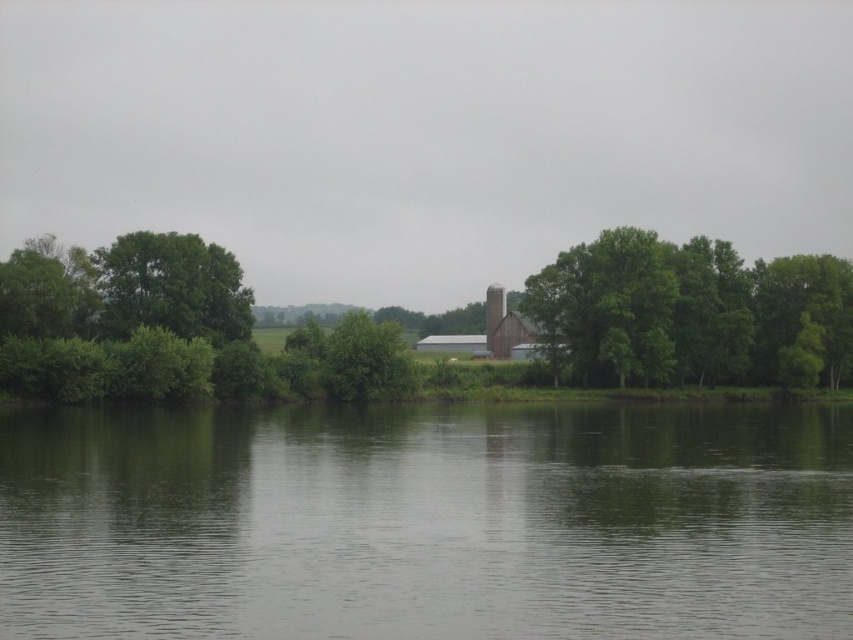
Is green leafy tree at center below brown wooden chimney at center?

Yes, green leafy tree at center is below brown wooden chimney at center.

What do you see at coordinates (691, 314) in the screenshot? The width and height of the screenshot is (853, 640). I see `green leafy tree at center` at bounding box center [691, 314].

This screenshot has width=853, height=640. What are the coordinates of `green leafy tree at center` in the screenshot? It's located at (691, 314).

Can you confirm if green smooth water at lower center is smaller than green leafy tree at center?

Correct, green smooth water at lower center occupies less space than green leafy tree at center.

Which is in front, point (361, 554) or point (682, 304)?

Point (361, 554)

You are a GUI agent. You are given a task and a screenshot of the screen. Output one action in this format:
    pyautogui.click(x=<x>, y=<y>)
    Task: Click on the green smooth water at lower center
    The height and width of the screenshot is (640, 853).
    Given the screenshot: What is the action you would take?
    pyautogui.click(x=427, y=522)

Is green smooth water at lower center bigger than brown wooden chimney at center?

Yes, green smooth water at lower center is bigger than brown wooden chimney at center.

Is green smooth water at lower center to the left of brown wooden chimney at center from the viewer's perspective?

Indeed, green smooth water at lower center is positioned on the left side of brown wooden chimney at center.

Locate an element on the screen. green smooth water at lower center is located at coordinates (427, 522).

The width and height of the screenshot is (853, 640). I want to click on green smooth water at lower center, so click(x=427, y=522).